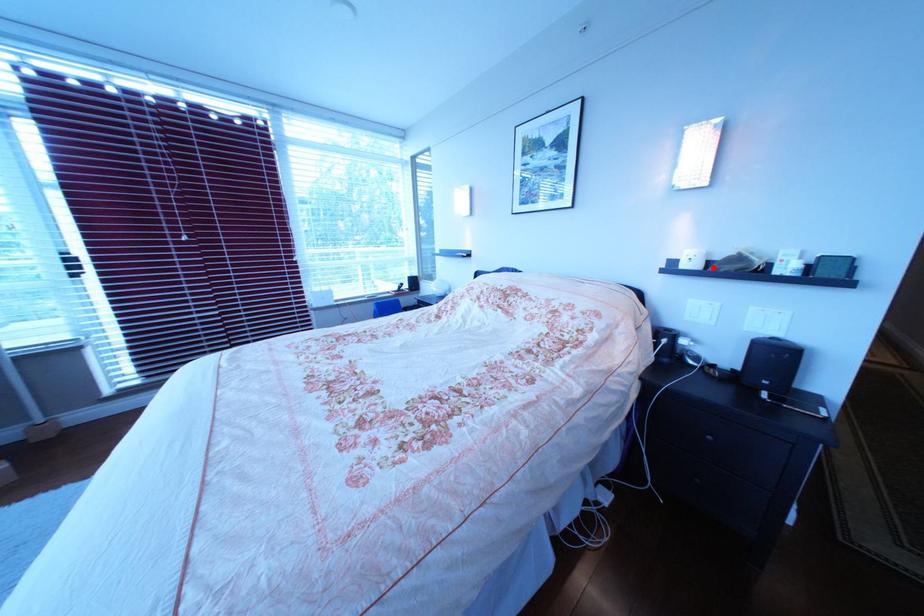
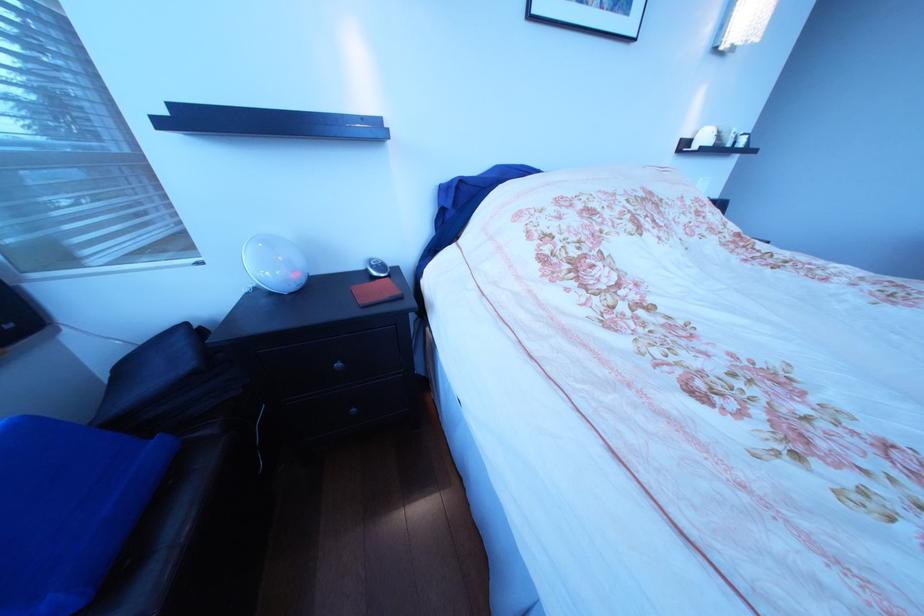
Find the pixel in the second image that matches the highlighted location in the first image.

(724, 146)